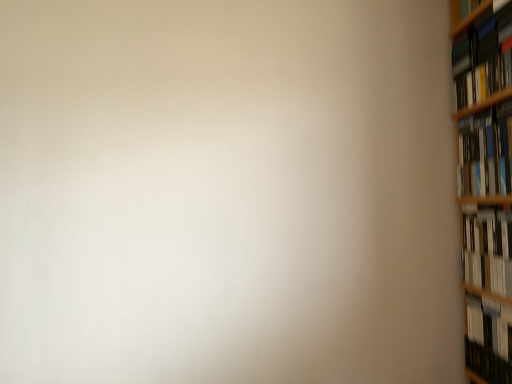
Question: Considering the relative sizes of white glossy book at right, positioned as the second book in bottom-to-top order, and hardcover book at right, the 2th book when ordered from top to bottom, in the image provided, is white glossy book at right, positioned as the second book in bottom-to-top order, wider than hardcover book at right, the 2th book when ordered from top to bottom,?

Choices:
 (A) yes
 (B) no

Answer: (B)

Question: Is white glossy book at right, acting as the 3th book starting from the top, touching hardcover book at right, the 2th book when ordered from top to bottom?

Choices:
 (A) yes
 (B) no

Answer: (B)

Question: Is white glossy book at right, positioned as the second book in bottom-to-top order, surrounding hardcover book at right, the third book positioned from the bottom?

Choices:
 (A) no
 (B) yes

Answer: (A)

Question: Is white glossy book at right, positioned as the second book in bottom-to-top order, positioned in front of hardcover book at right, the third book positioned from the bottom?

Choices:
 (A) no
 (B) yes

Answer: (B)

Question: From a real-world perspective, is white glossy book at right, acting as the 3th book starting from the top, beneath hardcover book at right, the 2th book when ordered from top to bottom?

Choices:
 (A) no
 (B) yes

Answer: (B)

Question: From a real-world perspective, is white glossy book at right, positioned as the second book in bottom-to-top order, positioned over hardcover book at right, the third book positioned from the bottom, based on gravity?

Choices:
 (A) no
 (B) yes

Answer: (A)

Question: Is white glossy book at right, acting as the 3th book starting from the top, at the left side of hardcover book at right, the fourth book from the top?

Choices:
 (A) yes
 (B) no

Answer: (A)

Question: Considering the relative sizes of white glossy book at right, acting as the 3th book starting from the top, and hardcover book at right, the fourth book from the top, in the image provided, is white glossy book at right, acting as the 3th book starting from the top, thinner than hardcover book at right, the fourth book from the top,?

Choices:
 (A) no
 (B) yes

Answer: (A)

Question: Can you confirm if white glossy book at right, acting as the 3th book starting from the top, is wider than hardcover book at right, which appears as the 1th book when ordered from the bottom?

Choices:
 (A) yes
 (B) no

Answer: (A)

Question: From a real-world perspective, is white glossy book at right, positioned as the second book in bottom-to-top order, physically below hardcover book at right, the fourth book from the top?

Choices:
 (A) yes
 (B) no

Answer: (B)

Question: Considering the relative sizes of white glossy book at right, positioned as the second book in bottom-to-top order, and hardcover book at right, the fourth book from the top, in the image provided, is white glossy book at right, positioned as the second book in bottom-to-top order, shorter than hardcover book at right, the fourth book from the top,?

Choices:
 (A) yes
 (B) no

Answer: (B)

Question: Is white glossy book at right, positioned as the second book in bottom-to-top order, closer to camera compared to hardcover book at right, the fourth book from the top?

Choices:
 (A) yes
 (B) no

Answer: (A)

Question: Does hardcover book at upper right, the fourth book in the bottom-to-top sequence, appear on the left side of hardcover book at right, the 2th book when ordered from top to bottom?

Choices:
 (A) no
 (B) yes

Answer: (B)